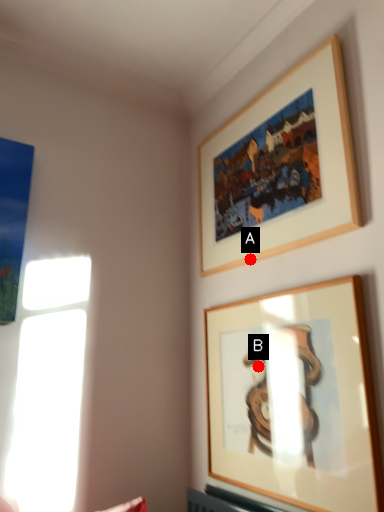
Question: Two points are circled on the image, labeled by A and B beside each circle. Among these points, which one is farthest from the camera?

Choices:
 (A) A is further
 (B) B is further

Answer: (A)